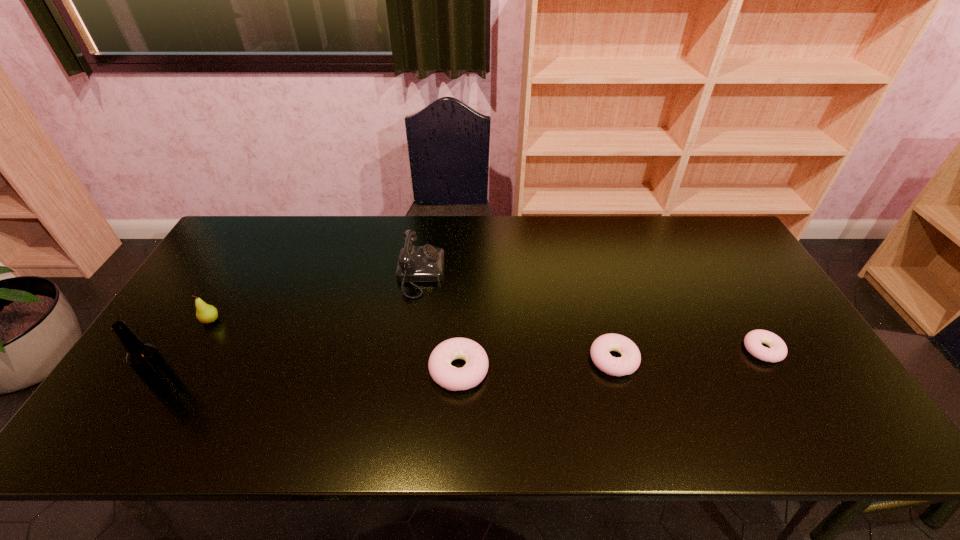
Find the location of `vacant area situated 0.300m on the back of the second doughnut from left to right`. vacant area situated 0.300m on the back of the second doughnut from left to right is located at coordinates (588, 266).

Where is `free space located on the left of the shortest doughnut`? free space located on the left of the shortest doughnut is located at coordinates (634, 350).

The width and height of the screenshot is (960, 540). I want to click on blank space located 0.290m on the back of the pear, so click(252, 249).

I want to click on vacant region located 0.070m on the dial of the farthest object, so click(466, 274).

This screenshot has height=540, width=960. Find the location of `vacant space situated on the right of the beer bottle`. vacant space situated on the right of the beer bottle is located at coordinates (328, 387).

The height and width of the screenshot is (540, 960). I want to click on object that is positioned at the far edge, so click(x=425, y=263).

Identify the location of beer bottle that is positioned at the near edge. (145, 359).

Identify the location of pear at the left edge. This screenshot has width=960, height=540. (205, 313).

The image size is (960, 540). I want to click on beer bottle present at the left edge, so click(145, 359).

Where is `object at the right edge`? Image resolution: width=960 pixels, height=540 pixels. object at the right edge is located at coordinates (777, 352).